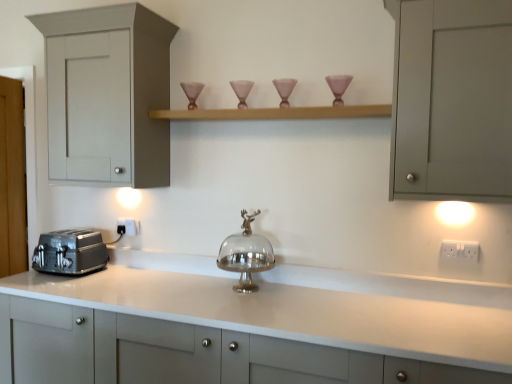
Question: Does white plastic electric outlet at lower center, which is the second electric outlet in front-to-back order, have a smaller size compared to matte pink glass candle holder at upper right?

Choices:
 (A) yes
 (B) no

Answer: (A)

Question: Is white plastic electric outlet at lower center, which is counted as the 1th electric outlet, starting from the left, facing towards matte pink glass candle holder at upper right?

Choices:
 (A) yes
 (B) no

Answer: (B)

Question: From a real-world perspective, is white plastic electric outlet at lower center, which is counted as the 1th electric outlet, starting from the left, physically below matte pink glass candle holder at upper right?

Choices:
 (A) yes
 (B) no

Answer: (A)

Question: Is white plastic electric outlet at lower center, which is the second electric outlet in front-to-back order, behind matte pink glass candle holder at upper right?

Choices:
 (A) no
 (B) yes

Answer: (B)

Question: Considering the relative sizes of white plastic electric outlet at lower center, positioned as the second electric outlet in right-to-left order, and matte pink glass candle holder at upper right in the image provided, is white plastic electric outlet at lower center, positioned as the second electric outlet in right-to-left order, shorter than matte pink glass candle holder at upper right?

Choices:
 (A) no
 (B) yes

Answer: (B)

Question: Is white plastic electric outlet at lower center, acting as the first electric outlet starting from the back, turned away from matte pink glass candle holder at upper right?

Choices:
 (A) no
 (B) yes

Answer: (A)

Question: Would you say silver metallic cake stand at center contains white plastic electric outlet at lower center, positioned as the second electric outlet in right-to-left order?

Choices:
 (A) yes
 (B) no

Answer: (B)

Question: Does silver metallic cake stand at center have a larger size compared to white plastic electric outlet at lower center, which is the second electric outlet in front-to-back order?

Choices:
 (A) yes
 (B) no

Answer: (A)

Question: Can you confirm if silver metallic cake stand at center is smaller than white plastic electric outlet at lower center, which is the second electric outlet in front-to-back order?

Choices:
 (A) no
 (B) yes

Answer: (A)

Question: Is silver metallic cake stand at center not close to white plastic electric outlet at lower center, positioned as the second electric outlet in right-to-left order?

Choices:
 (A) yes
 (B) no

Answer: (B)

Question: From the image's perspective, is silver metallic cake stand at center located beneath white plastic electric outlet at lower center, positioned as the second electric outlet in right-to-left order?

Choices:
 (A) no
 (B) yes

Answer: (B)

Question: From a real-world perspective, is silver metallic cake stand at center on top of white plastic electric outlet at lower center, which is counted as the 1th electric outlet, starting from the left?

Choices:
 (A) yes
 (B) no

Answer: (B)

Question: Could matte gray cabinet at left, the first cabinetry in the top-to-bottom sequence, be considered to be inside wooden shelf at upper center?

Choices:
 (A) no
 (B) yes

Answer: (A)